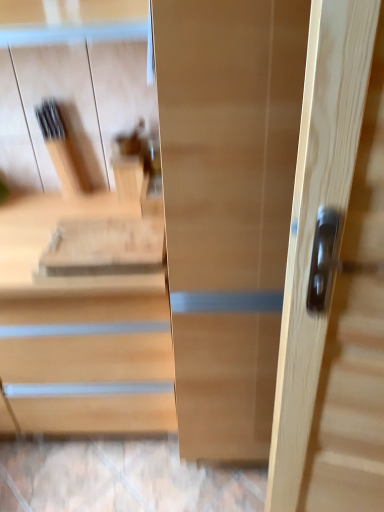
At what (x,y) coordinates should I click in order to perform the action: click on light wood cabinet at center. Please return your answer as a coordinate pair (x, y). The width and height of the screenshot is (384, 512). Looking at the image, I should click on (68, 286).

Describe the element at coordinates (68, 286) in the screenshot. The image size is (384, 512). I see `light wood cabinet at center` at that location.

Where is `light wood cabinet at center`? light wood cabinet at center is located at coordinates (68, 286).